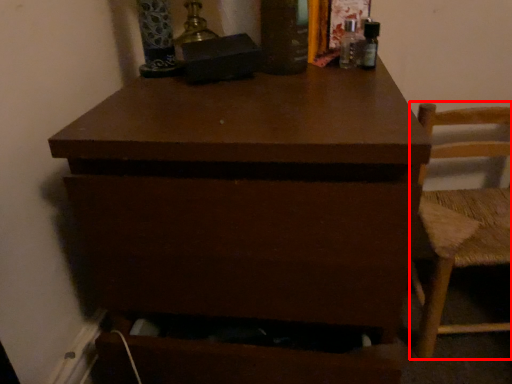
Question: From the image's perspective, where is chair (annotated by the red box) located in relation to chest of drawers in the image?

Choices:
 (A) above
 (B) below

Answer: (B)